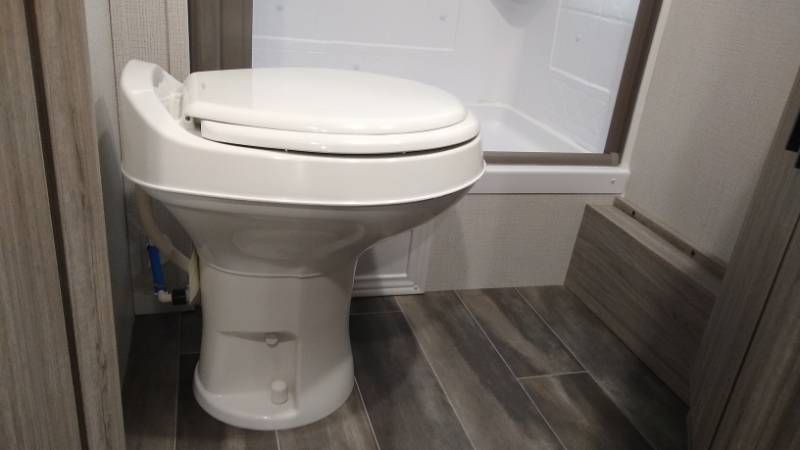
Where is `steel bracket`? The width and height of the screenshot is (800, 450). steel bracket is located at coordinates coord(177,296).